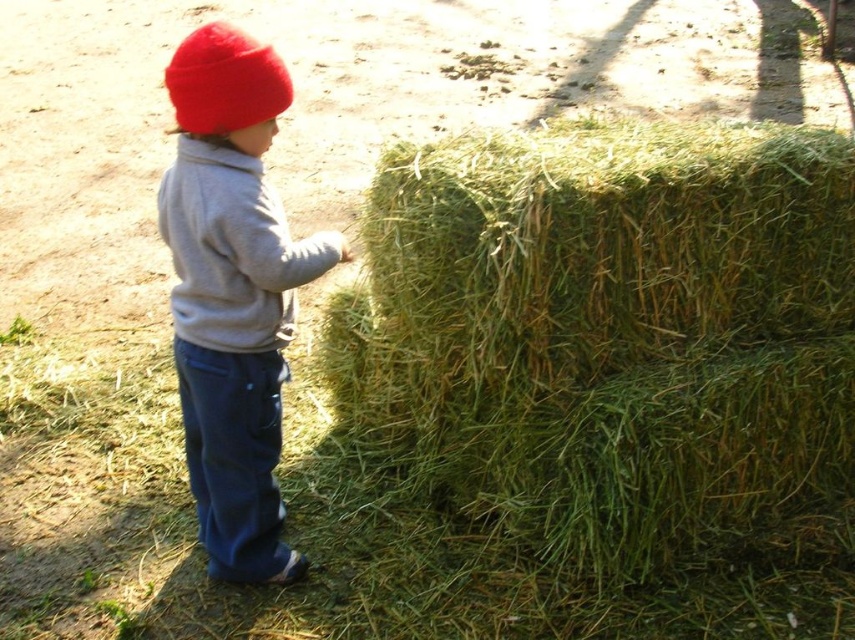
Can you confirm if gray fleece sweatshirt at center is shorter than red fleece beanie at upper left?

Incorrect, gray fleece sweatshirt at center's height does not fall short of red fleece beanie at upper left's.

Between gray fleece sweatshirt at center and red fleece beanie at upper left, which one is positioned higher?

red fleece beanie at upper left is higher up.

Is point (276, 268) more distant than point (213, 131)?

Yes, it is behind point (213, 131).

At what (x,y) coordinates should I click in order to perform the action: click on gray fleece sweatshirt at center. Please return your answer as a coordinate pair (x, y). This screenshot has width=855, height=640. Looking at the image, I should click on (233, 250).

How much distance is there between green straw bale at center and red fleece beanie at upper left?

green straw bale at center is 3.86 feet away from red fleece beanie at upper left.

Does green straw bale at center have a greater height compared to red fleece beanie at upper left?

Correct, green straw bale at center is much taller as red fleece beanie at upper left.

Is point (608, 230) positioned after point (198, 36)?

Yes.

Find the location of a particular element. green straw bale at center is located at coordinates (588, 364).

Can you confirm if matte gray sweatshirt at center is taller than red fleece beanie at upper left?

Yes.

Does matte gray sweatshirt at center come behind red fleece beanie at upper left?

No.

Which is behind, point (217, 518) or point (172, 83)?

The point (217, 518) is more distant.

I want to click on matte gray sweatshirt at center, so click(x=233, y=292).